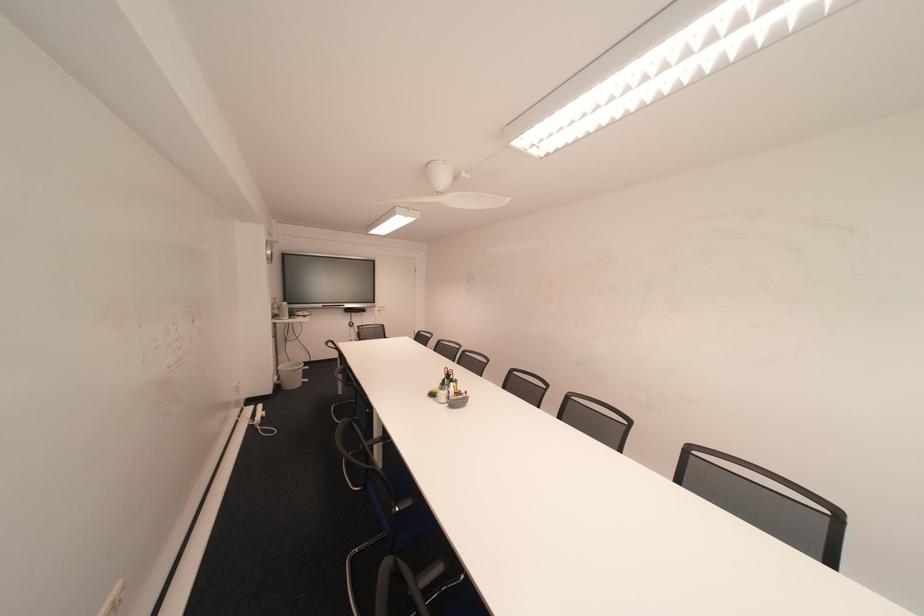
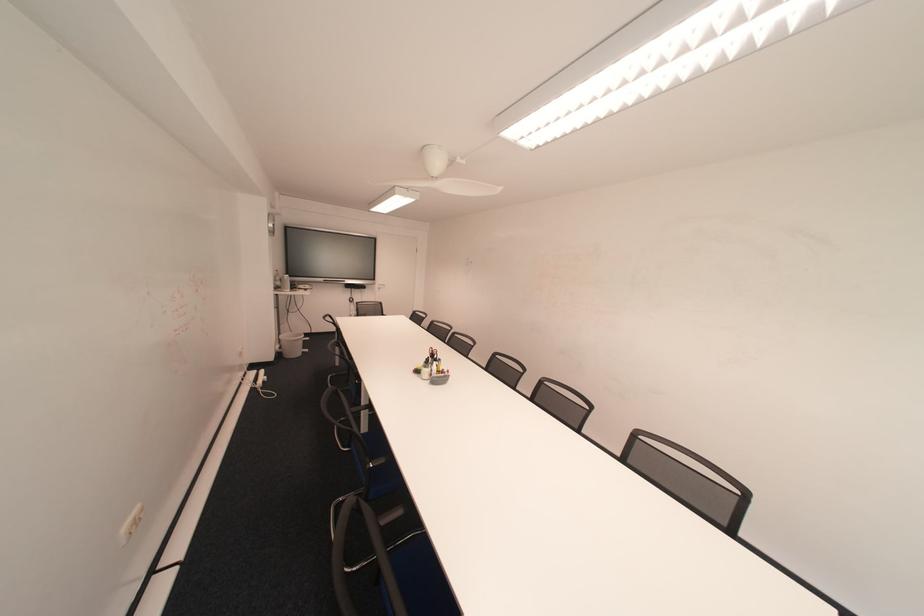
Find the pixel in the second image that matches [288,387] in the first image.

(290, 355)